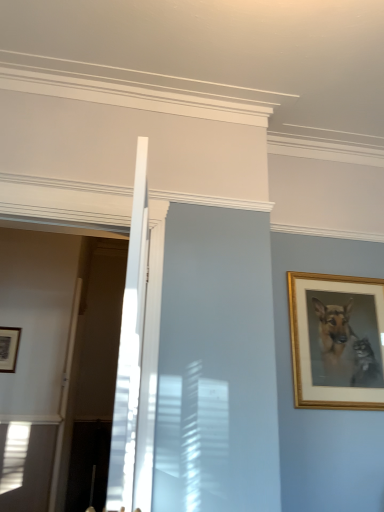
Question: From a real-world perspective, is gold/golden frame at right, placed as the 1th picture frame when sorted from front to back, over matte black picture frame at lower left, which is counted as the second picture frame, starting from the front?

Choices:
 (A) yes
 (B) no

Answer: (A)

Question: Is gold/golden frame at right, which ranks as the first picture frame in right-to-left order, facing towards matte black picture frame at lower left, which is counted as the second picture frame, starting from the front?

Choices:
 (A) yes
 (B) no

Answer: (B)

Question: Can you confirm if gold/golden frame at right, placed as the 1th picture frame when sorted from front to back, is positioned to the right of matte black picture frame at lower left, which is the 2th picture frame in right-to-left order?

Choices:
 (A) yes
 (B) no

Answer: (A)

Question: Is gold/golden frame at right, acting as the 2th picture frame starting from the left, thinner than matte black picture frame at lower left, the first picture frame from the left?

Choices:
 (A) no
 (B) yes

Answer: (A)

Question: Is gold/golden frame at right, which ranks as the first picture frame in right-to-left order, directly adjacent to matte black picture frame at lower left, which is counted as the second picture frame, starting from the front?

Choices:
 (A) yes
 (B) no

Answer: (B)

Question: Is gold/golden frame at right, placed as the 1th picture frame when sorted from front to back, wider than matte black picture frame at lower left, the 1th picture frame viewed from the back?

Choices:
 (A) no
 (B) yes

Answer: (B)

Question: Is matte black picture frame at lower left, which is counted as the second picture frame, starting from the front, at the left side of gold/golden frame at right, which ranks as the first picture frame in right-to-left order?

Choices:
 (A) yes
 (B) no

Answer: (A)

Question: Would you say gold/golden frame at right, placed as the 1th picture frame when sorted from front to back, is part of matte black picture frame at lower left, which is counted as the second picture frame, starting from the front,'s contents?

Choices:
 (A) yes
 (B) no

Answer: (B)

Question: Can you confirm if matte black picture frame at lower left, which is counted as the second picture frame, starting from the front, is wider than gold/golden frame at right, which ranks as the first picture frame in right-to-left order?

Choices:
 (A) yes
 (B) no

Answer: (B)

Question: Considering the relative sizes of matte black picture frame at lower left, which is counted as the second picture frame, starting from the front, and gold/golden frame at right, arranged as the second picture frame when viewed from the back, in the image provided, is matte black picture frame at lower left, which is counted as the second picture frame, starting from the front, bigger than gold/golden frame at right, arranged as the second picture frame when viewed from the back,?

Choices:
 (A) no
 (B) yes

Answer: (A)

Question: Is matte black picture frame at lower left, which is counted as the second picture frame, starting from the front, far away from gold/golden frame at right, placed as the 1th picture frame when sorted from front to back?

Choices:
 (A) yes
 (B) no

Answer: (A)

Question: Is matte black picture frame at lower left, the first picture frame from the left, turned away from gold/golden frame at right, placed as the 1th picture frame when sorted from front to back?

Choices:
 (A) no
 (B) yes

Answer: (A)

Question: In terms of size, does gold/golden frame at right, arranged as the second picture frame when viewed from the back, appear bigger or smaller than matte black picture frame at lower left, the first picture frame from the left?

Choices:
 (A) small
 (B) big

Answer: (B)